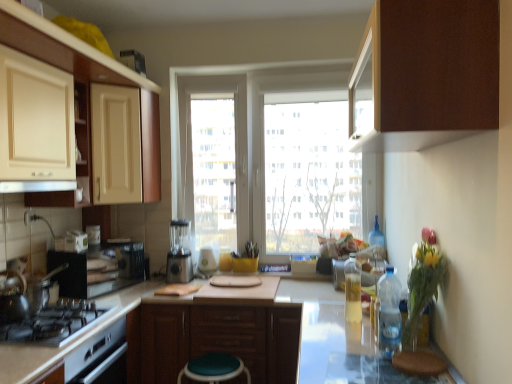
What are the coordinates of `clear plastic bottle at right, placed as the third bottle when sorted from front to back` in the screenshot? It's located at (377, 238).

This screenshot has width=512, height=384. Describe the element at coordinates (377, 238) in the screenshot. I see `clear plastic bottle at right, placed as the 2th bottle when sorted from back to front` at that location.

Measure the distance between point (x=5, y=188) and camera.

They are 1.86 meters apart.

Describe the element at coordinates (225, 260) in the screenshot. I see `translucent plastic bottle at center, the 1th bottle viewed from the back` at that location.

What do you see at coordinates (55, 324) in the screenshot?
I see `black matte gas stove at lower left` at bounding box center [55, 324].

Where is `teal fabric stool at lower center, acting as the first step stool starting from the left`? This screenshot has width=512, height=384. teal fabric stool at lower center, acting as the first step stool starting from the left is located at coordinates (214, 368).

From the picture: What's the angular difference between matte wood shelf at upper left, the second shelf viewed from the left, and matte cream cabinet at upper left, which is the second shelf in right-to-left order,'s facing directions?

matte wood shelf at upper left, the second shelf viewed from the left, and matte cream cabinet at upper left, which is the second shelf in right-to-left order, are facing 3.24 degrees away from each other.

This screenshot has width=512, height=384. I want to click on shelf in front of the matte wood shelf at upper left, the second shelf viewed from the left, so click(76, 162).

Is matte wood shelf at upper left, the second shelf viewed from the left, with matte cream cabinet at upper left, the 1th shelf positioned from the left?

No, matte wood shelf at upper left, the second shelf viewed from the left, is not beside matte cream cabinet at upper left, the 1th shelf positioned from the left.

Is matte wood shelf at upper left, the second shelf viewed from the left, to the left of matte cream cabinet at upper left, which is the second shelf in right-to-left order, from the viewer's perspective?

No.

Does point (53, 206) come behind point (47, 369)?

That is True.

From a real-world perspective, is matte cream cabinet at upper left, the 1th shelf positioned from the left, above or below white glossy countertop at lower left?

matte cream cabinet at upper left, the 1th shelf positioned from the left, is above white glossy countertop at lower left.

Who is more distant, matte cream cabinet at upper left, the 1th shelf positioned from the left, or white glossy countertop at lower left?

Positioned behind is matte cream cabinet at upper left, the 1th shelf positioned from the left.

Between point (227, 269) and point (255, 355), which one is positioned in front?

The point (255, 355) is in front.

How many degrees apart are the facing directions of translucent plastic bottle at center, the 1th bottle viewed from the back, and brown matte cabinet at center, which is counted as the 1th cabinetry, starting from the bottom?

translucent plastic bottle at center, the 1th bottle viewed from the back, and brown matte cabinet at center, which is counted as the 1th cabinetry, starting from the bottom, are facing 0.279 degrees away from each other.

From the image's perspective, which bottle is the 1st one above the brown matte cabinet at center, which is counted as the 1th cabinetry, starting from the bottom? Please provide its 2D coordinates.

[(225, 260)]

From their relative heights in the image, would you say translucent plastic bottle at center, the 1th bottle viewed from the back, is taller or shorter than brown matte cabinet at center, acting as the second cabinetry starting from the left?

Considering their sizes, translucent plastic bottle at center, the 1th bottle viewed from the back, has less height than brown matte cabinet at center, acting as the second cabinetry starting from the left.

What's the angular difference between matte cream cabinet at upper left, the 1th shelf positioned from the left, and white glossy exhaust hood at upper center's facing directions?

0.181 degrees.

Considering the sizes of objects matte cream cabinet at upper left, the 1th shelf positioned from the left, and white glossy exhaust hood at upper center in the image provided, who is wider, matte cream cabinet at upper left, the 1th shelf positioned from the left, or white glossy exhaust hood at upper center?

With larger width is white glossy exhaust hood at upper center.

Would you say white glossy exhaust hood at upper center is part of matte cream cabinet at upper left, which is the second shelf in right-to-left order,'s contents?

No.

Is matte cream cabinet at upper left, which is the second shelf in right-to-left order, positioned with its back to white glossy exhaust hood at upper center?

No, white glossy exhaust hood at upper center is not at the back of matte cream cabinet at upper left, which is the second shelf in right-to-left order.

Considering the positions of points (88, 95) and (412, 248), is point (88, 95) farther from camera compared to point (412, 248)?

Yes, point (88, 95) is behind point (412, 248).

Between matte wood shelf at upper left, which is counted as the 1th shelf, starting from the right, and translucent glass vase at right, which one has larger width?

Wider between the two is translucent glass vase at right.

Considering the sizes of objects matte wood shelf at upper left, the second shelf viewed from the left, and translucent glass vase at right in the image provided, who is taller, matte wood shelf at upper left, the second shelf viewed from the left, or translucent glass vase at right?

Standing taller between the two is translucent glass vase at right.

From the image's perspective, is matte wood shelf at upper left, which is counted as the 1th shelf, starting from the right, above or below translucent glass vase at right?

Clearly, from the image's perspective, matte wood shelf at upper left, which is counted as the 1th shelf, starting from the right, is above translucent glass vase at right.

Measure the distance from matte cream cabinet at upper left, which is the second shelf in right-to-left order, to translucent plastic bottle at center, the first bottle positioned from the left.

matte cream cabinet at upper left, which is the second shelf in right-to-left order, and translucent plastic bottle at center, the first bottle positioned from the left, are 1.17 meters apart from each other.

Is matte cream cabinet at upper left, which is the second shelf in right-to-left order, further to camera compared to translucent plastic bottle at center, positioned as the 4th bottle in front-to-back order?

No, matte cream cabinet at upper left, which is the second shelf in right-to-left order, is in front of translucent plastic bottle at center, positioned as the 4th bottle in front-to-back order.

From the image's perspective, relative to translucent plastic bottle at center, the first bottle positioned from the left, is matte cream cabinet at upper left, which is the second shelf in right-to-left order, above or below?

Based on their image positions, matte cream cabinet at upper left, which is the second shelf in right-to-left order, is located above translucent plastic bottle at center, the first bottle positioned from the left.

Is matte cream cabinet at upper left, which is the second shelf in right-to-left order, looking in the opposite direction of translucent plastic bottle at center, the first bottle positioned from the left?

That's not correct — matte cream cabinet at upper left, which is the second shelf in right-to-left order, is not looking away from translucent plastic bottle at center, the first bottle positioned from the left.

Looking at the image, does matte wood shelf at upper left, which is counted as the 1th shelf, starting from the right, seem bigger or smaller compared to metallic silver blender at center, which is counted as the first appliance, starting from the back?

matte wood shelf at upper left, which is counted as the 1th shelf, starting from the right, is smaller than metallic silver blender at center, which is counted as the first appliance, starting from the back.

Is matte wood shelf at upper left, the second shelf viewed from the left, facing towards metallic silver blender at center, which is the 2th appliance from left to right?

No, matte wood shelf at upper left, the second shelf viewed from the left, is not facing towards metallic silver blender at center, which is the 2th appliance from left to right.

Which object is closer to the camera taking this photo, matte wood shelf at upper left, the second shelf viewed from the left, or metallic silver blender at center, which is the first appliance from right to left?

matte wood shelf at upper left, the second shelf viewed from the left, is in front.

This screenshot has width=512, height=384. I want to click on shelf that appears on the right of matte cream cabinet at upper left, the 1th shelf positioned from the left, so click(x=81, y=103).

I want to click on counter top that appears in front of the matte cream cabinet at upper left, the 1th shelf positioned from the left, so click(x=68, y=343).

Based on their spatial positions, is clear plastic bottle at center, which is counted as the third bottle, starting from the right, or brown fabric step stool at lower right, acting as the second step stool starting from the bottom, closer to satin silver blender at center, marked as the 2th appliance in a back-to-front arrangement?

Based on the image, clear plastic bottle at center, which is counted as the third bottle, starting from the right, appears to be nearer to satin silver blender at center, marked as the 2th appliance in a back-to-front arrangement.

Looking at the image, which one is located closer to brown fabric step stool at lower right, which is the first step stool in right-to-left order, brown matte cabinet at center, which is counted as the 1th cabinetry, starting from the bottom, or translucent glass vase at right?

The object closer to brown fabric step stool at lower right, which is the first step stool in right-to-left order, is translucent glass vase at right.

Looking at the image, which one is located further to black matte gas stove at lower left, satin silver blender at center, the 1th appliance from the left, or clear plastic bottle at right, the 3th bottle in the left-to-right sequence?

Based on the image, clear plastic bottle at right, the 3th bottle in the left-to-right sequence, appears to be further to black matte gas stove at lower left.

Estimate the real-world distances between objects in this image. Which object is closer to brown matte cabinet at center, the 3th cabinetry positioned from the top, white glossy countertop at lower left or matte cream cabinet at left, which is the third cabinetry from right to left?

white glossy countertop at lower left.

Based on their spatial positions, is translucent glass vase at right or white glossy exhaust hood at upper center closer to matte wood shelf at upper left, which is counted as the 1th shelf, starting from the right?

white glossy exhaust hood at upper center is positioned closer to the anchor matte wood shelf at upper left, which is counted as the 1th shelf, starting from the right.

Which object lies further to the anchor point translucent glass vase at right, black matte gas stove at lower left or white glossy exhaust hood at upper center?

white glossy exhaust hood at upper center.

Looking at the image, which one is located further to matte wood shelf at upper left, which is counted as the 1th shelf, starting from the right, clear plastic bottle at right, marked as the first bottle in a front-to-back arrangement, or clear plastic bottle at center, the third bottle from the back?

The object further to matte wood shelf at upper left, which is counted as the 1th shelf, starting from the right, is clear plastic bottle at right, marked as the first bottle in a front-to-back arrangement.

Which object lies nearer to the anchor point clear plastic bottle at right, placed as the third bottle when sorted from front to back, brown matte cabinet at upper right, acting as the 1th cabinetry starting from the top, or translucent plastic bottle at center, the fourth bottle viewed from the right?

Among the two, translucent plastic bottle at center, the fourth bottle viewed from the right, is located nearer to clear plastic bottle at right, placed as the third bottle when sorted from front to back.

Find the location of a particular element. gas stove situated between white glossy exhaust hood at upper center and translucent glass vase at right from left to right is located at coordinates (55, 324).

At what (x,y) coordinates should I click in order to perform the action: click on gas stove between shiny metallic tea pot at left and teal fabric stool at lower center, which is counted as the 1th step stool, starting from the back, from left to right. Please return your answer as a coordinate pair (x, y). Looking at the image, I should click on (55, 324).

This screenshot has height=384, width=512. What are the coordinates of `appliance between brown matte cabinet at upper right, acting as the 1th cabinetry starting from the top, and clear plastic bottle at right, which ranks as the first bottle in right-to-left order, along the z-axis` in the screenshot? It's located at 179,253.

The height and width of the screenshot is (384, 512). Identify the location of step stool between matte cream cabinet at left, the first cabinetry when ordered from left to right, and brown matte cabinet at upper right, marked as the 3th cabinetry in a left-to-right arrangement. (214, 368).